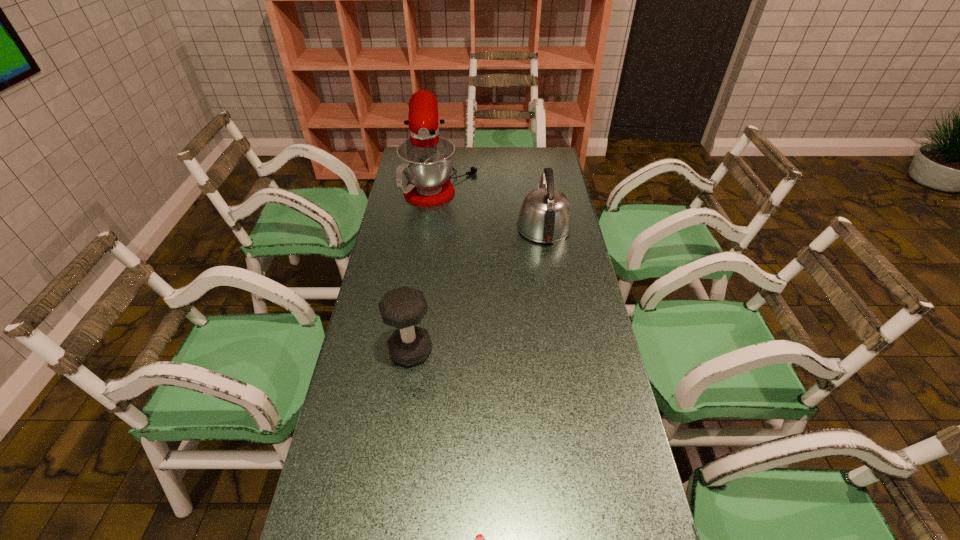
Locate an element on the screen. The width and height of the screenshot is (960, 540). mixer is located at coordinates (426, 159).

Where is `the rightmost object`? The image size is (960, 540). the rightmost object is located at coordinates (545, 216).

I want to click on the second nearest object, so click(x=404, y=307).

Identify the location of vacant region located 0.110m on the bowl side of the mixer. The height and width of the screenshot is (540, 960). (502, 177).

This screenshot has height=540, width=960. I want to click on vacant space located on the spout of the rightmost object, so click(534, 169).

Identify the location of vacant position located on the spout of the rightmost object. This screenshot has height=540, width=960. (539, 197).

Image resolution: width=960 pixels, height=540 pixels. What are the coordinates of `free space located on the spout of the rightmost object` in the screenshot? It's located at (534, 168).

Image resolution: width=960 pixels, height=540 pixels. I want to click on blank area located on the right of the dumbbell, so pos(559,350).

I want to click on object present at the far edge, so 426,159.

Locate an element on the screen. Image resolution: width=960 pixels, height=540 pixels. mixer situated at the left edge is located at coordinates (426, 159).